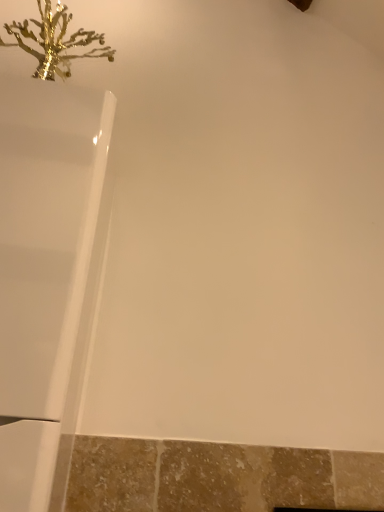
Question: Can gold metallic coral at upper left be found inside white glossy bathtub at upper left?

Choices:
 (A) yes
 (B) no

Answer: (B)

Question: Considering the relative sizes of white glossy bathtub at upper left and gold metallic coral at upper left in the image provided, is white glossy bathtub at upper left shorter than gold metallic coral at upper left?

Choices:
 (A) no
 (B) yes

Answer: (A)

Question: Is white glossy bathtub at upper left smaller than gold metallic coral at upper left?

Choices:
 (A) no
 (B) yes

Answer: (A)

Question: From a real-world perspective, is white glossy bathtub at upper left located beneath gold metallic coral at upper left?

Choices:
 (A) no
 (B) yes

Answer: (B)

Question: Is white glossy bathtub at upper left to the right of gold metallic coral at upper left from the viewer's perspective?

Choices:
 (A) no
 (B) yes

Answer: (B)

Question: Is white glossy bathtub at upper left oriented away from gold metallic coral at upper left?

Choices:
 (A) yes
 (B) no

Answer: (B)

Question: Can you confirm if gold metallic coral at upper left is positioned to the right of white glossy bathtub at upper left?

Choices:
 (A) yes
 (B) no

Answer: (B)

Question: Is gold metallic coral at upper left taller than white glossy bathtub at upper left?

Choices:
 (A) yes
 (B) no

Answer: (B)

Question: Is gold metallic coral at upper left not within white glossy bathtub at upper left?

Choices:
 (A) yes
 (B) no

Answer: (A)

Question: Is gold metallic coral at upper left in front of white glossy bathtub at upper left?

Choices:
 (A) yes
 (B) no

Answer: (B)

Question: Is gold metallic coral at upper left directly adjacent to white glossy bathtub at upper left?

Choices:
 (A) yes
 (B) no

Answer: (B)

Question: Is gold metallic coral at upper left wider than white glossy bathtub at upper left?

Choices:
 (A) yes
 (B) no

Answer: (B)

Question: Considering the positions of white glossy bathtub at upper left and gold metallic coral at upper left in the image, is white glossy bathtub at upper left bigger or smaller than gold metallic coral at upper left?

Choices:
 (A) small
 (B) big

Answer: (B)